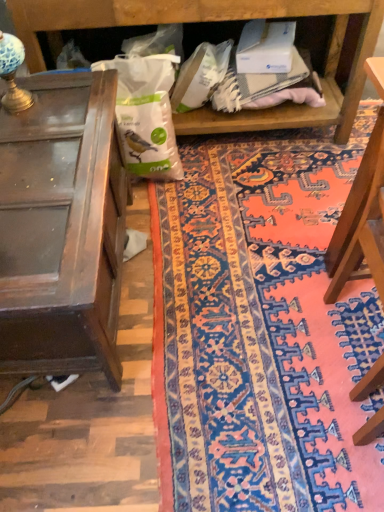
Question: Is white matte paper bag at center positioned far away from wooden chair at right?

Choices:
 (A) yes
 (B) no

Answer: (B)

Question: Can you see white matte paper bag at center touching wooden chair at right?

Choices:
 (A) yes
 (B) no

Answer: (B)

Question: Is white matte paper bag at center to the left of wooden chair at right from the viewer's perspective?

Choices:
 (A) yes
 (B) no

Answer: (A)

Question: Would you say white matte paper bag at center is outside wooden chair at right?

Choices:
 (A) yes
 (B) no

Answer: (A)

Question: Does white matte paper bag at center come in front of wooden chair at right?

Choices:
 (A) no
 (B) yes

Answer: (A)

Question: From their relative heights in the image, would you say white matte paper bag at center is taller or shorter than blue glass lamp at upper left?

Choices:
 (A) tall
 (B) short

Answer: (A)

Question: Considering the relative positions of white matte paper bag at center and blue glass lamp at upper left in the image provided, is white matte paper bag at center to the left or to the right of blue glass lamp at upper left?

Choices:
 (A) left
 (B) right

Answer: (B)

Question: Is white matte paper bag at center situated inside blue glass lamp at upper left or outside?

Choices:
 (A) inside
 (B) outside

Answer: (B)

Question: In terms of width, does white matte paper bag at center look wider or thinner when compared to blue glass lamp at upper left?

Choices:
 (A) thin
 (B) wide

Answer: (B)

Question: Considering the positions of white matte paper bag at center and wooden table at left in the image, is white matte paper bag at center taller or shorter than wooden table at left?

Choices:
 (A) tall
 (B) short

Answer: (B)

Question: Based on their positions, is white matte paper bag at center located to the left or right of wooden table at left?

Choices:
 (A) right
 (B) left

Answer: (A)

Question: Looking at their shapes, would you say white matte paper bag at center is wider or thinner than wooden table at left?

Choices:
 (A) thin
 (B) wide

Answer: (A)

Question: Which is correct: white matte paper bag at center is inside wooden table at left, or outside of it?

Choices:
 (A) outside
 (B) inside

Answer: (A)

Question: Is wooden chair at right inside or outside of patterned carpet at center?

Choices:
 (A) inside
 (B) outside

Answer: (B)

Question: In the image, is wooden chair at right positioned in front of or behind patterned carpet at center?

Choices:
 (A) behind
 (B) front

Answer: (B)